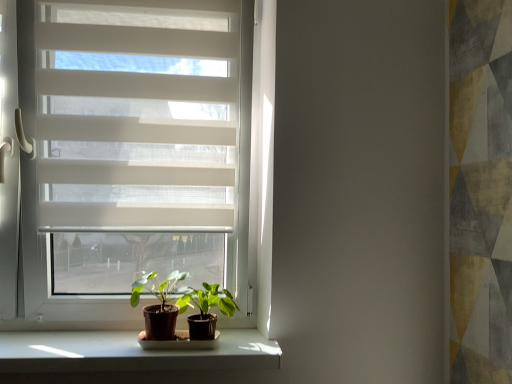
Identify the location of vacant area situated to the left side of brown matte pot at lower center. (110, 342).